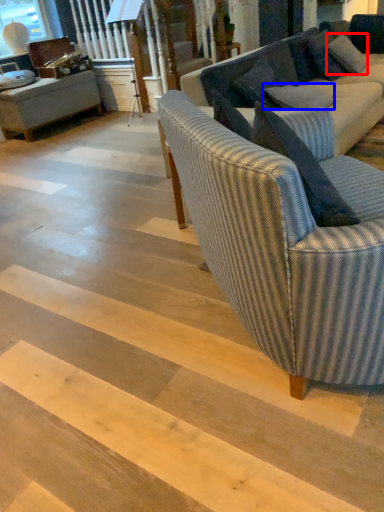
Question: Which point is further to the camera, pillow (highlighted by a red box) or pillow (highlighted by a blue box)?

Choices:
 (A) pillow
 (B) pillow

Answer: (A)